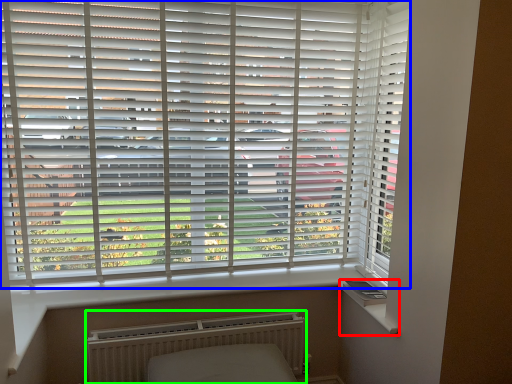
Question: Which object is the farthest from window sill (highlighted by a red box)? Choose among these: window blind (highlighted by a blue box) or radiator (highlighted by a green box).

Choices:
 (A) window blind
 (B) radiator

Answer: (A)